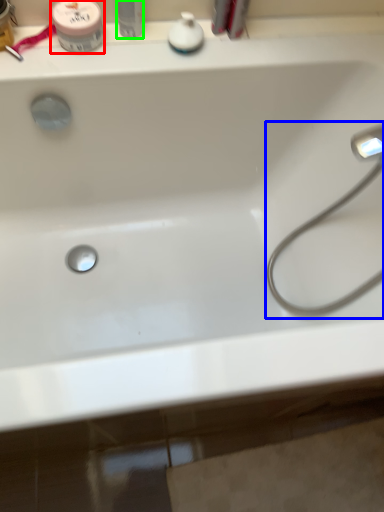
Question: Which object is the farthest from mouthwash (highlighted by a red box)? Choose among these: faucet (highlighted by a blue box) or toiletry (highlighted by a green box).

Choices:
 (A) faucet
 (B) toiletry

Answer: (A)